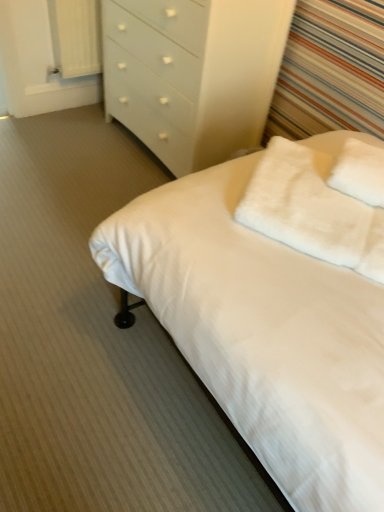
Where is `free space to the left of white fluffy pillow at upper right, marked as the first pillow in a right-to-left arrangement`? free space to the left of white fluffy pillow at upper right, marked as the first pillow in a right-to-left arrangement is located at coordinates (311, 179).